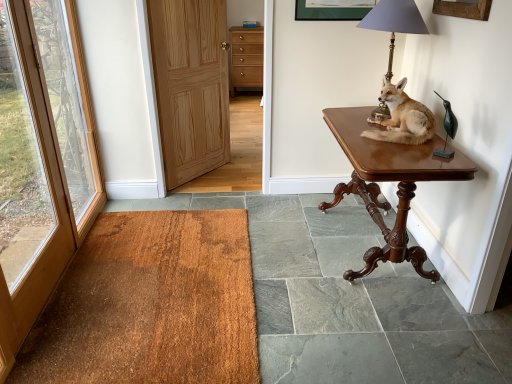
Question: From the image's perspective, is blue plastic corded phone at upper center located beneath brown fur taxidermy fox at upper right?

Choices:
 (A) yes
 (B) no

Answer: (B)

Question: Considering the relative sizes of blue plastic corded phone at upper center and brown fur taxidermy fox at upper right in the image provided, is blue plastic corded phone at upper center bigger than brown fur taxidermy fox at upper right?

Choices:
 (A) yes
 (B) no

Answer: (B)

Question: Is blue plastic corded phone at upper center beside brown fur taxidermy fox at upper right?

Choices:
 (A) yes
 (B) no

Answer: (B)

Question: Can brown fur taxidermy fox at upper right be found inside blue plastic corded phone at upper center?

Choices:
 (A) no
 (B) yes

Answer: (A)

Question: Considering the relative sizes of blue plastic corded phone at upper center and brown fur taxidermy fox at upper right in the image provided, is blue plastic corded phone at upper center smaller than brown fur taxidermy fox at upper right?

Choices:
 (A) no
 (B) yes

Answer: (B)

Question: From a real-world perspective, is blue plastic corded phone at upper center below brown fur taxidermy fox at upper right?

Choices:
 (A) yes
 (B) no

Answer: (B)

Question: Does matte brass lamp at upper right have a smaller size compared to brown wood table at right?

Choices:
 (A) no
 (B) yes

Answer: (B)

Question: From a real-world perspective, is matte brass lamp at upper right on top of brown wood table at right?

Choices:
 (A) no
 (B) yes

Answer: (B)

Question: Considering the relative sizes of matte brass lamp at upper right and brown wood table at right in the image provided, is matte brass lamp at upper right bigger than brown wood table at right?

Choices:
 (A) no
 (B) yes

Answer: (A)

Question: Is matte brass lamp at upper right far from brown wood table at right?

Choices:
 (A) yes
 (B) no

Answer: (B)

Question: Considering the relative sizes of matte brass lamp at upper right and brown wood table at right in the image provided, is matte brass lamp at upper right thinner than brown wood table at right?

Choices:
 (A) yes
 (B) no

Answer: (A)

Question: Can you confirm if matte brass lamp at upper right is wider than brown wood table at right?

Choices:
 (A) no
 (B) yes

Answer: (A)

Question: Is brown fur taxidermy fox at upper right far away from light brown wood door at center, which appears as the 2th door when viewed from the left?

Choices:
 (A) no
 (B) yes

Answer: (B)